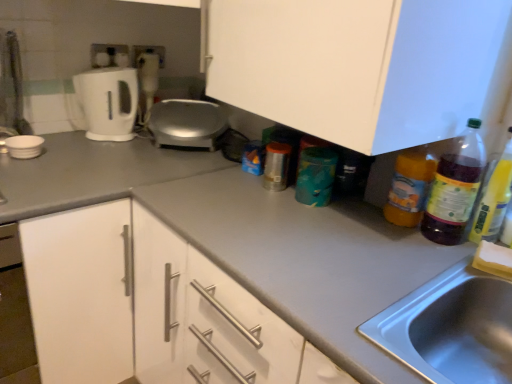
Where is `unoccupied area behind white matte bowl at left, which is the second appliance from right to left`? Image resolution: width=512 pixels, height=384 pixels. unoccupied area behind white matte bowl at left, which is the second appliance from right to left is located at coordinates (66, 138).